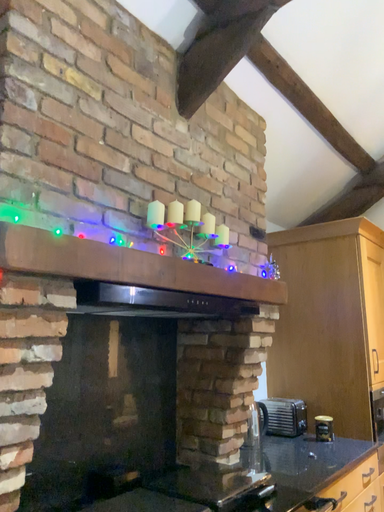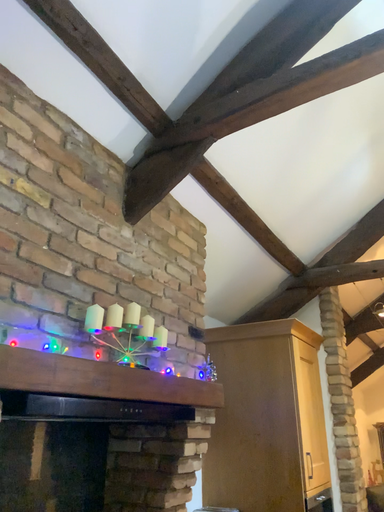
Question: Which way did the camera rotate in the video?

Choices:
 (A) rotated upward
 (B) rotated downward

Answer: (A)